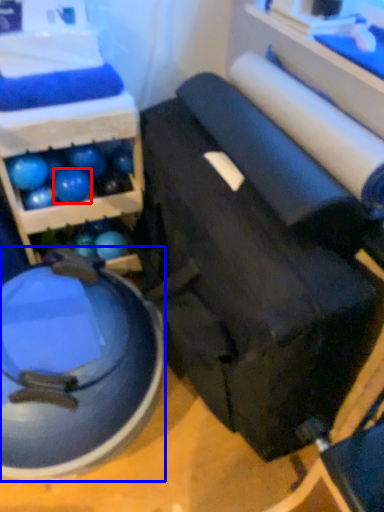
Question: Among these objects, which one is farthest to the camera, ball (highlighted by a red box) or swivel chair (highlighted by a blue box)?

Choices:
 (A) ball
 (B) swivel chair

Answer: (A)